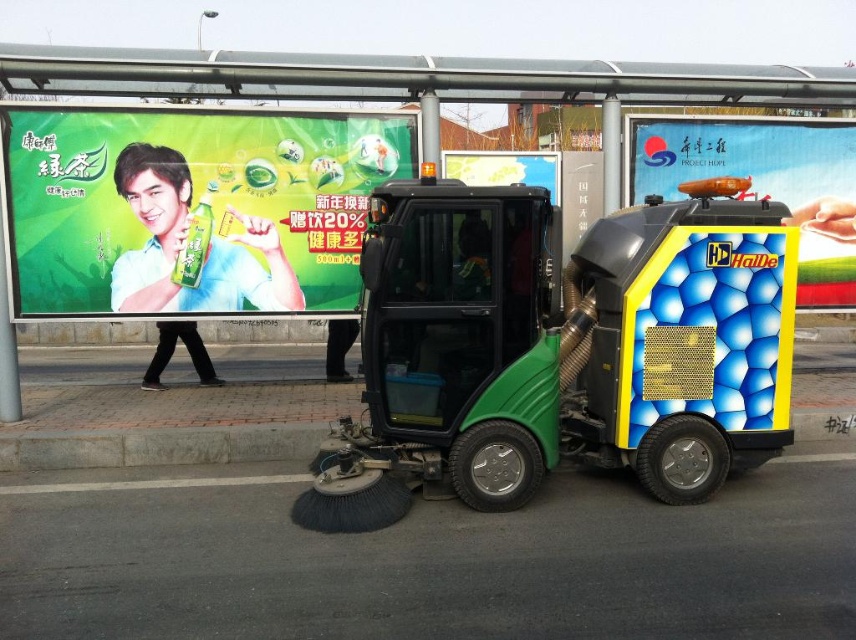
Question: Which point appears farthest from the camera in this image?

Choices:
 (A) (280, 276)
 (B) (370, 400)
 (C) (771, 154)

Answer: (C)

Question: Does green matte bottle at upper left have a greater width compared to yellow metallic billboard at center?

Choices:
 (A) yes
 (B) no

Answer: (A)

Question: Based on their relative distances, which object is farther from the green matte bottle at upper left?

Choices:
 (A) yellow hexagonal patterned panel at upper right
 (B) black pants at lower left
 (C) smooth green bottle at upper left

Answer: (A)

Question: Considering the relative positions of yellow hexagonal patterned panel at upper right and black pants at lower left in the image provided, where is yellow hexagonal patterned panel at upper right located with respect to black pants at lower left?

Choices:
 (A) below
 (B) above

Answer: (B)

Question: Estimate the real-world distances between objects in this image. Which object is closer to the green matte street sweeper at center?

Choices:
 (A) smooth green bottle at upper left
 (B) yellow metallic billboard at center
 (C) green matte bus stop at center

Answer: (C)

Question: Does yellow hexagonal patterned panel at upper right appear on the left side of smooth green bottle at upper left?

Choices:
 (A) yes
 (B) no

Answer: (B)